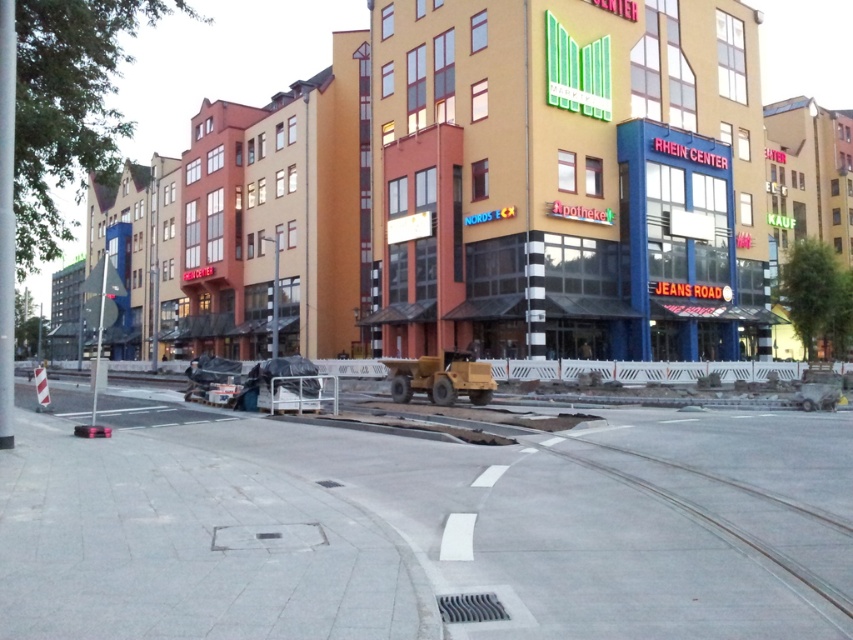
You are a delivery person with a cart that is 1.2 meters wide. You need to move from the concrete at center to the gray concrete train track at lower right. Is there enough space between them for your cart to pass through?

The concrete at center is 8.55 meters away from gray concrete train track at lower right. Since the cart is only 1.2 meters wide, there is more than enough space for it to pass through the 8.55 meters distance between them.

You are a delivery person with a cart that is 1.2 meters wide. You need to move from the gray concrete train track at lower right to the concrete at center. Can your cart fit through the space between them?

The concrete at center might be wider than gray concrete train track at lower right. Therefore, the space between them may be sufficient for your 1.2 meter wide cart, but there is uncertainty due to the comparative width mentioned.

From the picture: You are a delivery person who needs to place a large package on the ground. The package is too heavy to lift, so you must push it from where you are standing. You see the concrete at center and the gray concrete train track at lower right. Which surface can you push the package onto without it getting stuck?

The concrete at center has a larger size compared to the gray concrete train track at lower right, so you can push the package onto the concrete at center since it has more space to accommodate the package without getting stuck.